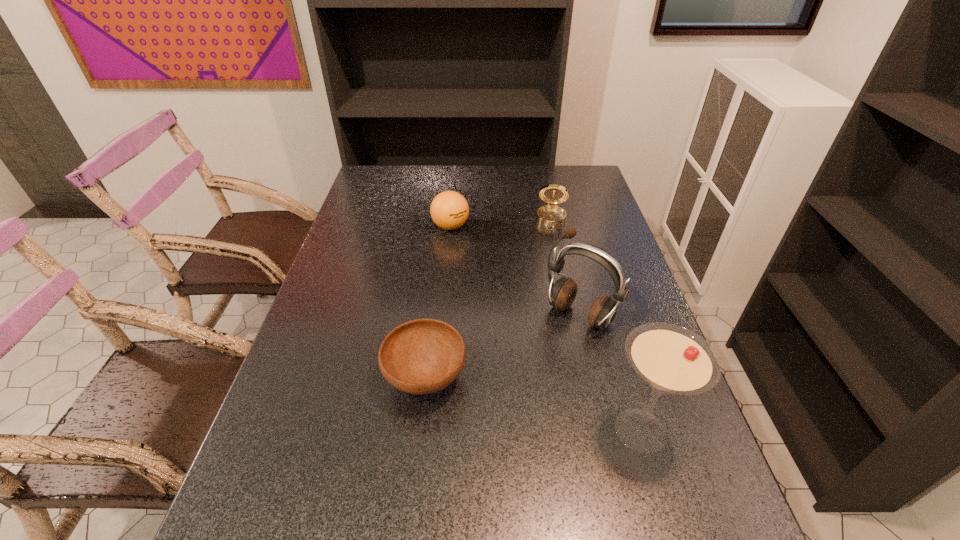
The image size is (960, 540). What are the coordinates of `free space located 0.330m on the ear pads of the third nearest object` in the screenshot? It's located at (484, 428).

Find the location of a particular element. The image size is (960, 540). free space located 0.130m on the ear pads of the third nearest object is located at coordinates (536, 367).

Identify the location of vacant area situated 0.250m on the ear pads of the third nearest object. This screenshot has height=540, width=960. (506, 402).

The width and height of the screenshot is (960, 540). I want to click on free space located 0.170m with the dial facing the compass, so click(x=548, y=262).

At what (x,y) coordinates should I click in order to perform the action: click on free region located 0.110m with the dial facing the compass. Please return your answer as a coordinate pair (x, y). Looking at the image, I should click on (549, 250).

Locate an element on the screen. This screenshot has width=960, height=540. vacant area situated with the dial facing the compass is located at coordinates pyautogui.click(x=543, y=303).

Find the location of a particular element. This screenshot has width=960, height=540. object located at the near edge is located at coordinates (671, 359).

At what (x,y) coordinates should I click in order to perform the action: click on martini at the right edge. Please return your answer as a coordinate pair (x, y). This screenshot has width=960, height=540. Looking at the image, I should click on (671, 359).

This screenshot has width=960, height=540. Identify the location of earphone that is positioned at the right edge. (561, 294).

Find the location of a particular element. The image size is (960, 540). compass positioned at the right edge is located at coordinates (551, 215).